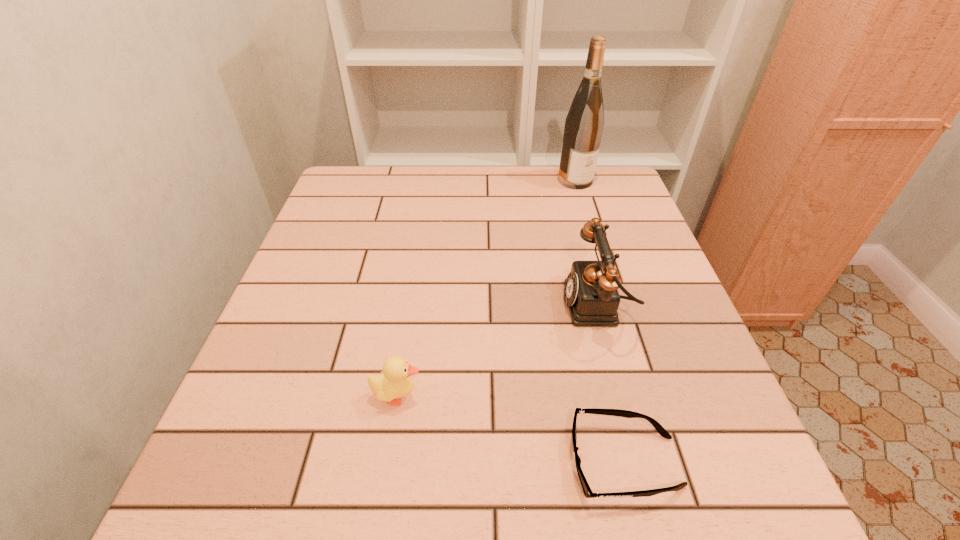
At what (x,y) coordinates should I click in order to perform the action: click on sunglasses that is positioned at the right edge. Please return your answer as a coordinate pair (x, y). The image size is (960, 540). Looking at the image, I should click on (588, 493).

The image size is (960, 540). Identify the location of object present at the far right corner. point(584,123).

Locate an element on the screen. object located at the near right corner is located at coordinates (588, 493).

The width and height of the screenshot is (960, 540). In order to click on free space at the near edge in this screenshot , I will do `click(375, 472)`.

Image resolution: width=960 pixels, height=540 pixels. In the image, there is a desktop. Identify the location of blank space at the left edge. (324, 231).

At what (x,y) coordinates should I click in order to perform the action: click on free spot at the right edge of the desktop. Please return your answer as a coordinate pair (x, y). Looking at the image, I should click on (623, 356).

You are a GUI agent. You are given a task and a screenshot of the screen. Output one action in this format:
    pyautogui.click(x=<x>, y=<y>)
    Task: Click on the vacant space at the far left corner of the desktop
    
    Given the screenshot: What is the action you would take?
    pyautogui.click(x=322, y=210)

You are a GUI agent. You are given a task and a screenshot of the screen. Output one action in this format:
    pyautogui.click(x=<x>, y=<y>)
    Task: Click on the free space at the near left corner
    The image size is (960, 540).
    Given the screenshot: What is the action you would take?
    pyautogui.click(x=237, y=526)

This screenshot has width=960, height=540. I want to click on blank area at the far right corner, so click(x=597, y=199).

The width and height of the screenshot is (960, 540). I want to click on vacant point located between the wine bottle and the duckling, so click(487, 288).